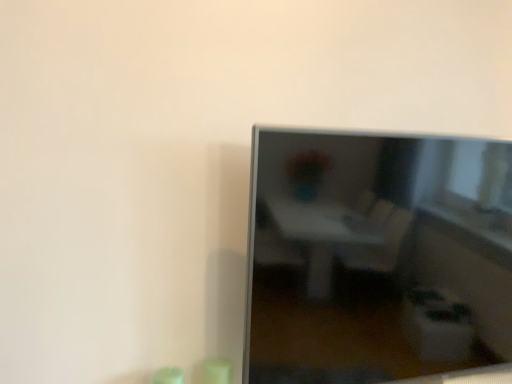
Describe the element at coordinates (378, 259) in the screenshot. This screenshot has height=384, width=512. I see `satin silver tv at right` at that location.

Where is `satin silver tv at right`? Image resolution: width=512 pixels, height=384 pixels. satin silver tv at right is located at coordinates (378, 259).

In order to face satin silver tv at right, should I rotate leftwards or rightwards?

Turn right approximately 20.784 degrees to face it.

At what (x,y) coordinates should I click in order to perform the action: click on satin silver tv at right. Please return your answer as a coordinate pair (x, y). The height and width of the screenshot is (384, 512). Looking at the image, I should click on (378, 259).